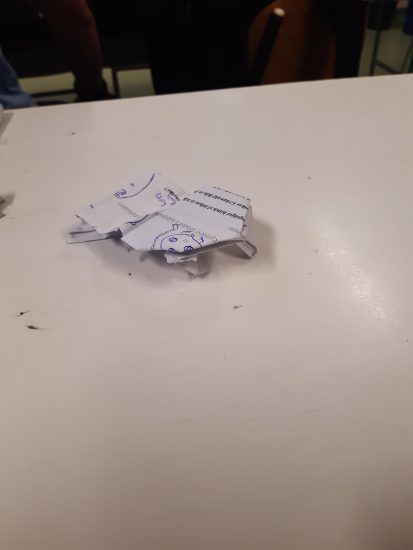
You are a GUI agent. You are given a task and a screenshot of the screen. Output one action in this format:
    pyautogui.click(x=<x>, y=<y>)
    Task: Click on the chair back
    This screenshot has height=550, width=413.
    Given the screenshot: What is the action you would take?
    pyautogui.click(x=297, y=10)